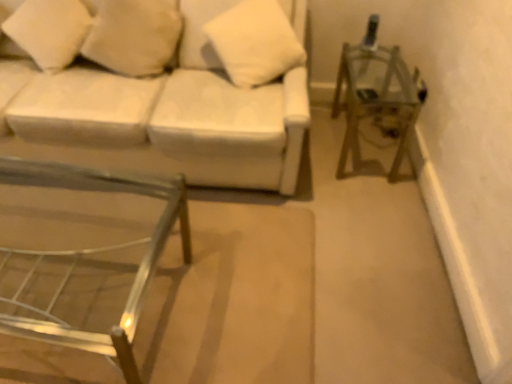
Question: From the image's perspective, is white soft pillow at upper left, marked as the 3th pillow in a right-to-left arrangement, beneath white fabric couch at upper left?

Choices:
 (A) no
 (B) yes

Answer: (A)

Question: Is the depth of white soft pillow at upper left, marked as the 3th pillow in a right-to-left arrangement, greater than that of white fabric couch at upper left?

Choices:
 (A) yes
 (B) no

Answer: (A)

Question: Is white soft pillow at upper left, marked as the 3th pillow in a right-to-left arrangement, wider than white fabric couch at upper left?

Choices:
 (A) yes
 (B) no

Answer: (B)

Question: Would you say white soft pillow at upper left, acting as the first pillow starting from the left, is outside white fabric couch at upper left?

Choices:
 (A) no
 (B) yes

Answer: (A)

Question: Considering the relative sizes of white soft pillow at upper left, acting as the first pillow starting from the left, and white fabric couch at upper left in the image provided, is white soft pillow at upper left, acting as the first pillow starting from the left, smaller than white fabric couch at upper left?

Choices:
 (A) no
 (B) yes

Answer: (B)

Question: Looking at their shapes, would you say white fabric couch at upper left is wider or thinner than metallic silver table at lower left?

Choices:
 (A) thin
 (B) wide

Answer: (B)

Question: From their relative heights in the image, would you say white fabric couch at upper left is taller or shorter than metallic silver table at lower left?

Choices:
 (A) tall
 (B) short

Answer: (A)

Question: Would you say white fabric couch at upper left is inside or outside metallic silver table at lower left?

Choices:
 (A) outside
 (B) inside

Answer: (A)

Question: From a real-world perspective, is white fabric couch at upper left physically located above or below metallic silver table at lower left?

Choices:
 (A) above
 (B) below

Answer: (A)

Question: Considering the positions of metallic silver side table at right and white soft pillow at upper left, acting as the first pillow starting from the left, in the image, is metallic silver side table at right wider or thinner than white soft pillow at upper left, acting as the first pillow starting from the left,?

Choices:
 (A) thin
 (B) wide

Answer: (B)

Question: From a real-world perspective, is metallic silver side table at right above or below white soft pillow at upper left, marked as the 3th pillow in a right-to-left arrangement?

Choices:
 (A) above
 (B) below

Answer: (B)

Question: Considering their positions, is metallic silver side table at right located in front of or behind white soft pillow at upper left, acting as the first pillow starting from the left?

Choices:
 (A) behind
 (B) front

Answer: (A)

Question: Do you think metallic silver side table at right is within white soft pillow at upper left, marked as the 3th pillow in a right-to-left arrangement, or outside of it?

Choices:
 (A) outside
 (B) inside

Answer: (A)

Question: Looking at their shapes, would you say metallic silver table at lower left is wider or thinner than white soft pillow at upper left, the second pillow viewed from the right?

Choices:
 (A) wide
 (B) thin

Answer: (A)

Question: In terms of height, does metallic silver table at lower left look taller or shorter compared to white soft pillow at upper left, arranged as the second pillow when viewed from the left?

Choices:
 (A) short
 (B) tall

Answer: (A)